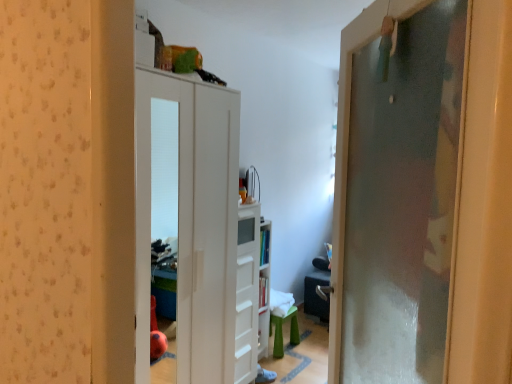
Question: From a real-world perspective, does frosted glass door at right, the second door in the back-to-front sequence, stand above white matte cabinet at center, the second door in the front-to-back sequence?

Choices:
 (A) no
 (B) yes

Answer: (B)

Question: Does frosted glass door at right, arranged as the 1th door when viewed from the front, have a lesser height compared to white matte cabinet at center, the second door viewed from the right?

Choices:
 (A) no
 (B) yes

Answer: (B)

Question: Does frosted glass door at right, arranged as the 1th door when viewed from the front, come behind white matte cabinet at center, marked as the 1th door in a left-to-right arrangement?

Choices:
 (A) yes
 (B) no

Answer: (B)

Question: Could you tell me if frosted glass door at right, the second door in the back-to-front sequence, is turned towards white matte cabinet at center, the second door in the front-to-back sequence?

Choices:
 (A) yes
 (B) no

Answer: (B)

Question: From the image's perspective, is frosted glass door at right, arranged as the 1th door when viewed from the front, on white matte cabinet at center, the second door in the front-to-back sequence?

Choices:
 (A) yes
 (B) no

Answer: (A)

Question: From the image's perspective, is white glossy dresser at center located above or below green plastic stool at lower center?

Choices:
 (A) below
 (B) above

Answer: (B)

Question: In the image, is white glossy dresser at center positioned in front of or behind green plastic stool at lower center?

Choices:
 (A) behind
 (B) front

Answer: (B)

Question: From a real-world perspective, is white glossy dresser at center physically located above or below green plastic stool at lower center?

Choices:
 (A) above
 (B) below

Answer: (A)

Question: Based on their sizes in the image, would you say white glossy dresser at center is bigger or smaller than green plastic stool at lower center?

Choices:
 (A) big
 (B) small

Answer: (A)

Question: Considering the positions of white matte cabinet at center, the second door in the front-to-back sequence, and white glossy dresser at center in the image, is white matte cabinet at center, the second door in the front-to-back sequence, bigger or smaller than white glossy dresser at center?

Choices:
 (A) big
 (B) small

Answer: (A)

Question: In terms of height, does white matte cabinet at center, marked as the 1th door in a left-to-right arrangement, look taller or shorter compared to white glossy dresser at center?

Choices:
 (A) short
 (B) tall

Answer: (B)

Question: Considering the relative positions of white matte cabinet at center, the second door viewed from the right, and white glossy dresser at center in the image provided, is white matte cabinet at center, the second door viewed from the right, to the left or to the right of white glossy dresser at center?

Choices:
 (A) right
 (B) left

Answer: (B)

Question: Considering the positions of point (180, 317) and point (256, 364), is point (180, 317) closer or farther from the camera than point (256, 364)?

Choices:
 (A) closer
 (B) farther

Answer: (A)

Question: Looking at their shapes, would you say frosted glass door at right, the second door in the back-to-front sequence, is wider or thinner than green plastic stool at lower center?

Choices:
 (A) thin
 (B) wide

Answer: (A)

Question: In the image, is frosted glass door at right, the 1th door in the right-to-left sequence, positioned in front of or behind green plastic stool at lower center?

Choices:
 (A) behind
 (B) front

Answer: (B)